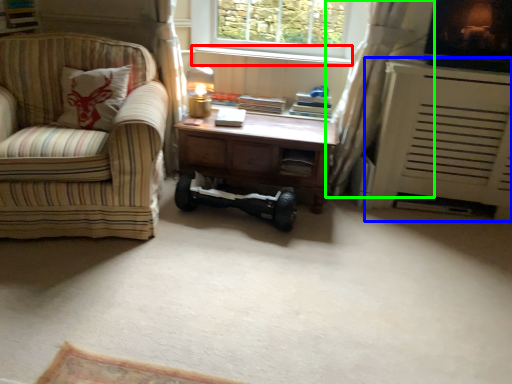
Question: Which object is the farthest from window sill (highlighted by a red box)? Choose among these: heater (highlighted by a blue box) or curtain (highlighted by a green box).

Choices:
 (A) heater
 (B) curtain

Answer: (A)